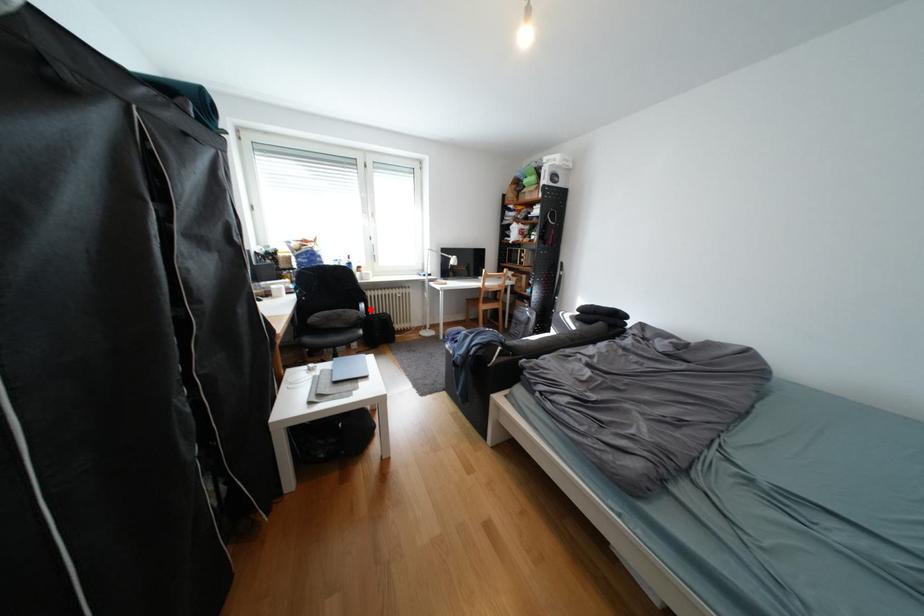
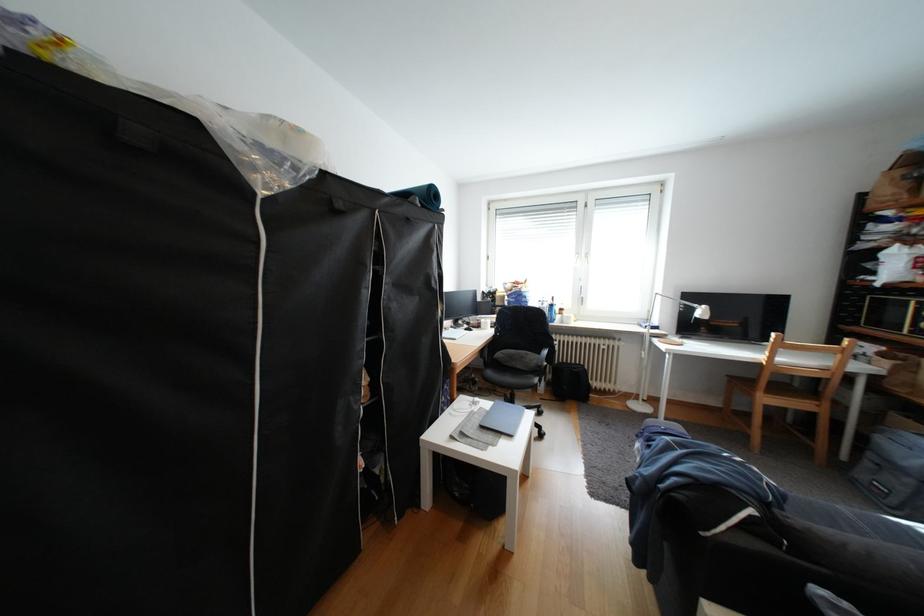
Where in the second image is the point corresponding to the highlighted location from the first image?

(553, 354)